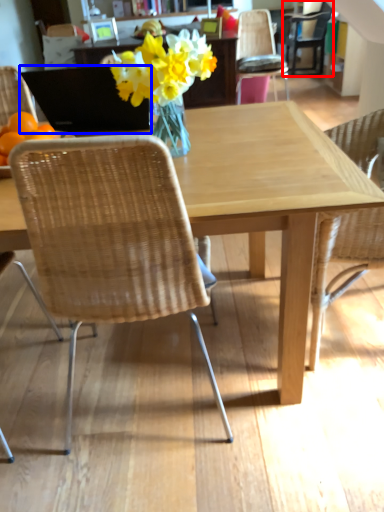
Question: Which point is closer to the camera, chair (highlighted by a red box) or laptop (highlighted by a blue box)?

Choices:
 (A) chair
 (B) laptop

Answer: (B)